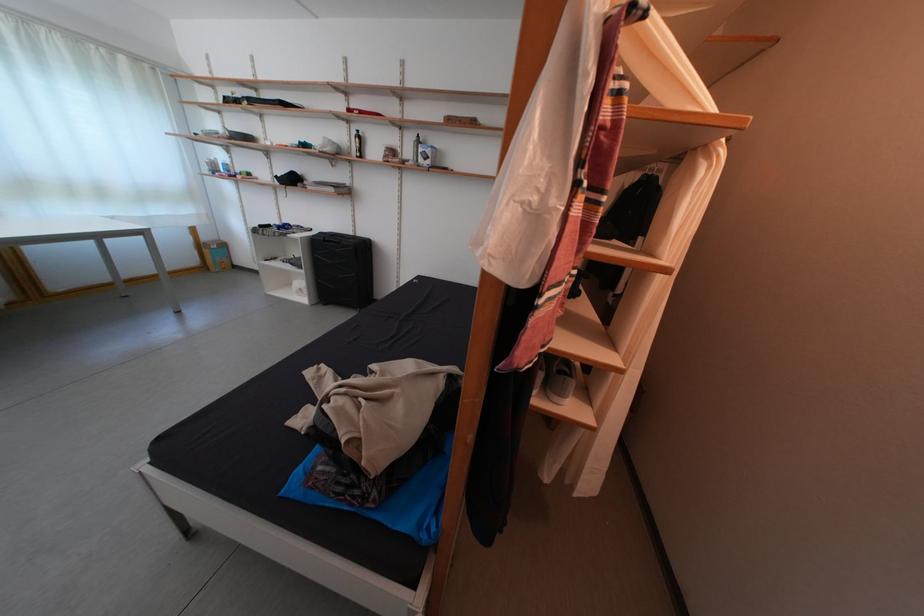
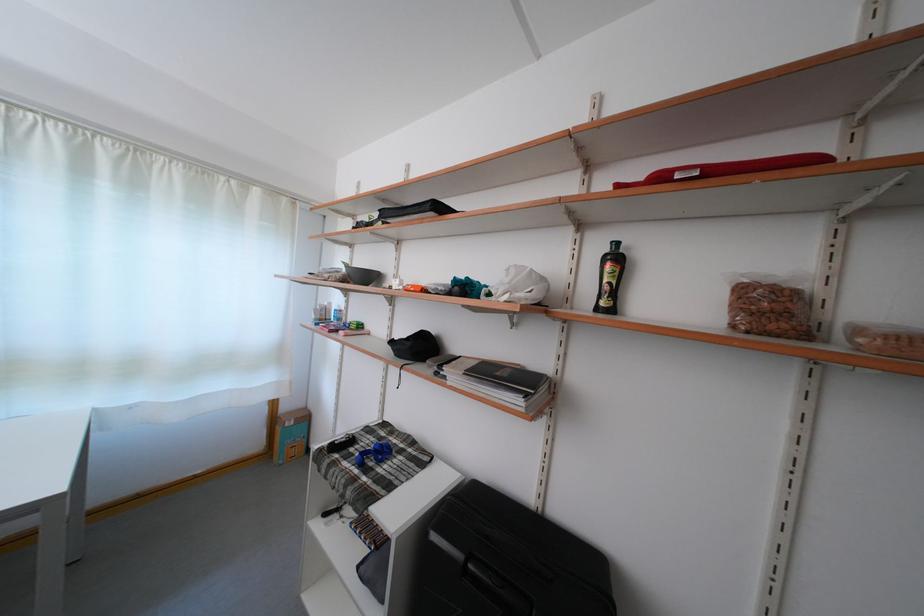
Where in the second image is the point corresponding to the point at 342,195 from the first image?

(527, 408)